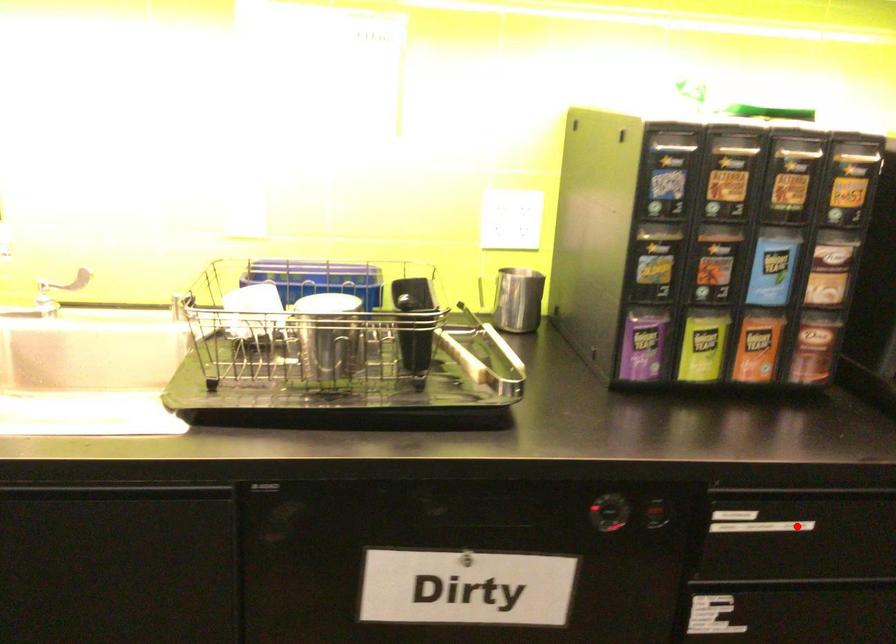
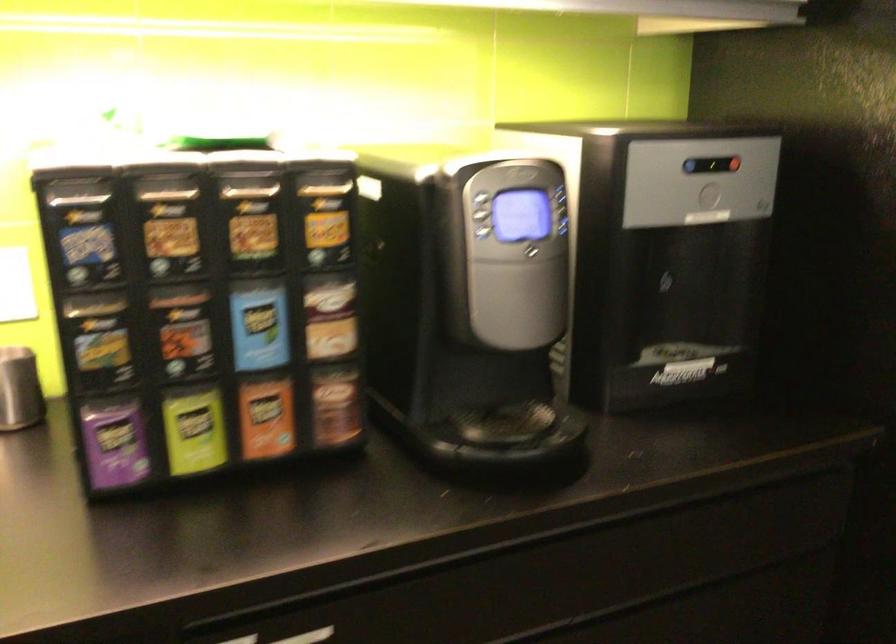
Question: I am providing you with two images of the same scene from different viewpoints. A red point is shown in image1. For the corresponding object point in image2, is it positioned nearer or farther from the camera?

Choices:
 (A) Nearer
 (B) Farther

Answer: (A)